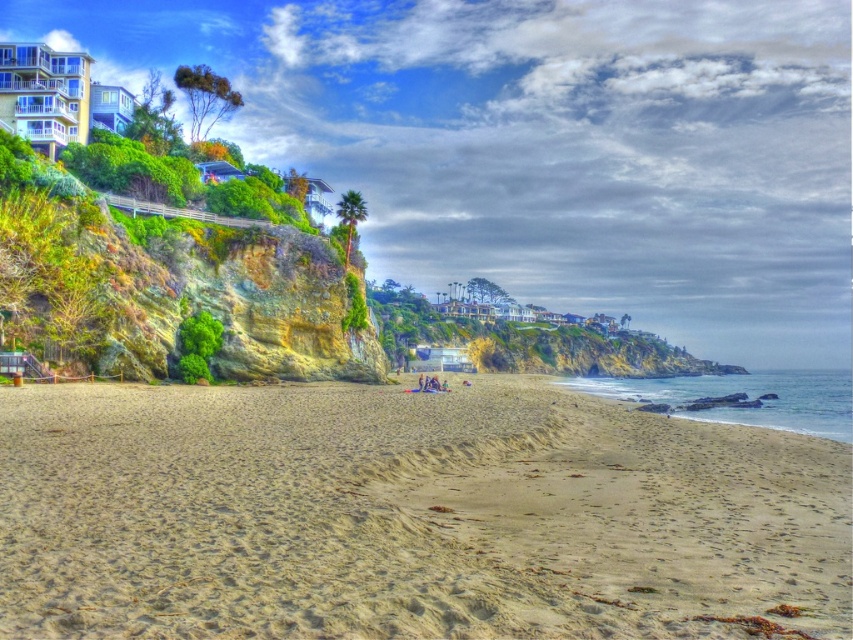
You are standing on the light beige sand at center and want to reach the green mossy rock at upper left. Which direction should you move to get there?

You should move upward from the light beige sand at center to reach the green mossy rock at upper left since it is positioned above it.

You are standing on the light beige sand at center and want to climb up to the green mossy rock at upper left. Based on the scene description, which direction should you move towards to reach the rock?

You should move towards the upper left direction to reach the green mossy rock at upper left from the light beige sand at center since the rock is located at the upper left position in the scene.